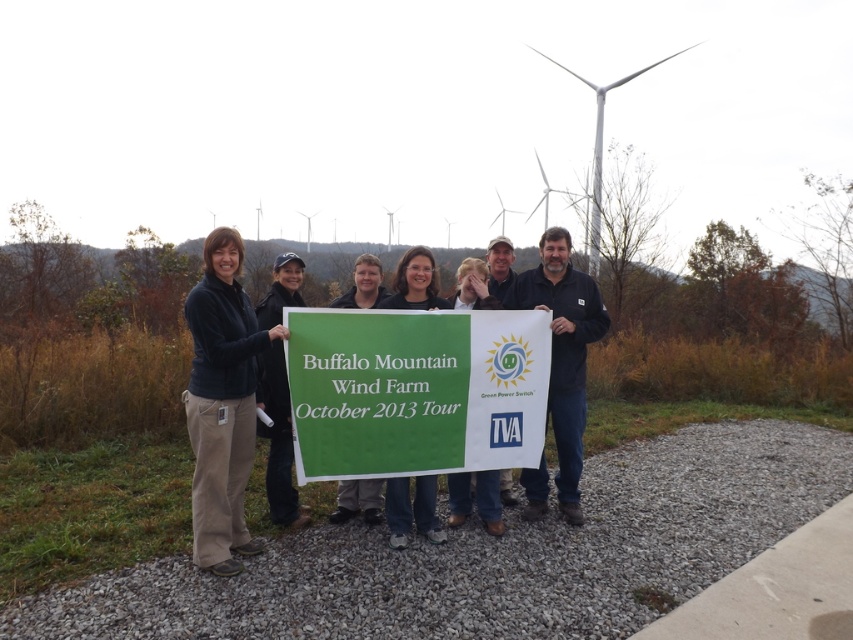
Question: Which point is farther to the camera?

Choices:
 (A) dark blue fleece at center
 (B) matte green sign at center

Answer: (B)

Question: Can you confirm if matte green sign at center is positioned below white composite wind turbine at upper center?

Choices:
 (A) yes
 (B) no

Answer: (A)

Question: Among these objects, which one is farthest from the camera?

Choices:
 (A) dark blue fleece at center
 (B) dark blue jacket at center
 (C) matte black shirt at center

Answer: (C)

Question: From the image, what is the correct spatial relationship of dark blue jacket at center in relation to dark blue fleece at center?

Choices:
 (A) right
 (B) left

Answer: (A)

Question: Does dark blue fleece at center appear under white composite wind turbine at upper center?

Choices:
 (A) no
 (B) yes

Answer: (B)

Question: Estimate the real-world distances between objects in this image. Which object is closer to the matte black shirt at center?

Choices:
 (A) matte green sign at center
 (B) green fabric sign at center
 (C) dark blue fleece at center

Answer: (B)